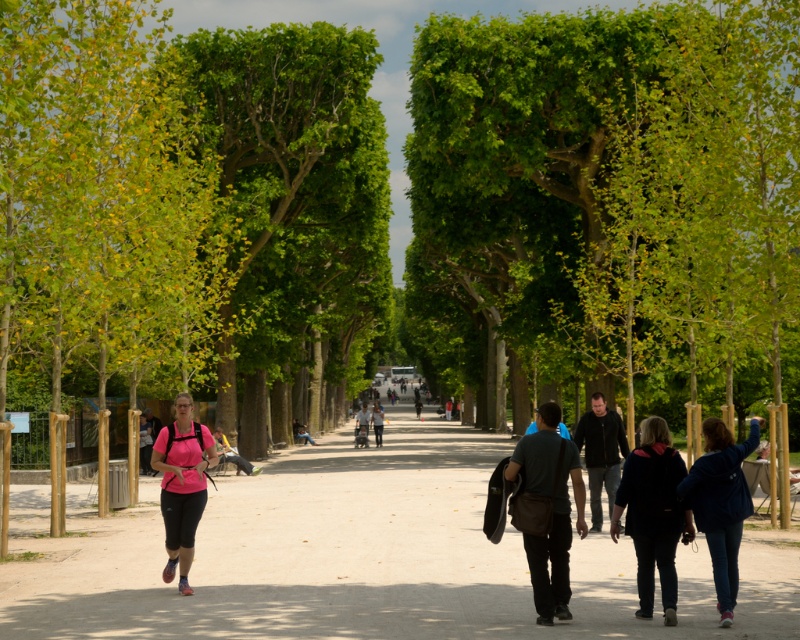
Question: Which object is the closest to the dark blue jacket at lower right?

Choices:
 (A) dark gray fabric jacket at center
 (B) green leafy tree at center
 (C) pink matte running shoes at lower left
 (D) matte black backpack at center

Answer: (A)

Question: Is matte black backpack at center further to camera compared to dark gray jacket at center?

Choices:
 (A) no
 (B) yes

Answer: (A)

Question: Can you confirm if denim jacket at lower right is bigger than dark gray jacket at center?

Choices:
 (A) no
 (B) yes

Answer: (A)

Question: Which object is the farthest from the pink fabric backpack at center?

Choices:
 (A) denim jacket at lower right
 (B) matte black backpack at center
 (C) green leafy tree at center

Answer: (A)

Question: Which of the following is the farthest from the observer?

Choices:
 (A) dark blue jacket at lower right
 (B) matte black backpack at center
 (C) dark blue jeans at center

Answer: (C)

Question: Does dark gray fabric jacket at center appear on the left side of dark brown leather jacket at center?

Choices:
 (A) yes
 (B) no

Answer: (A)